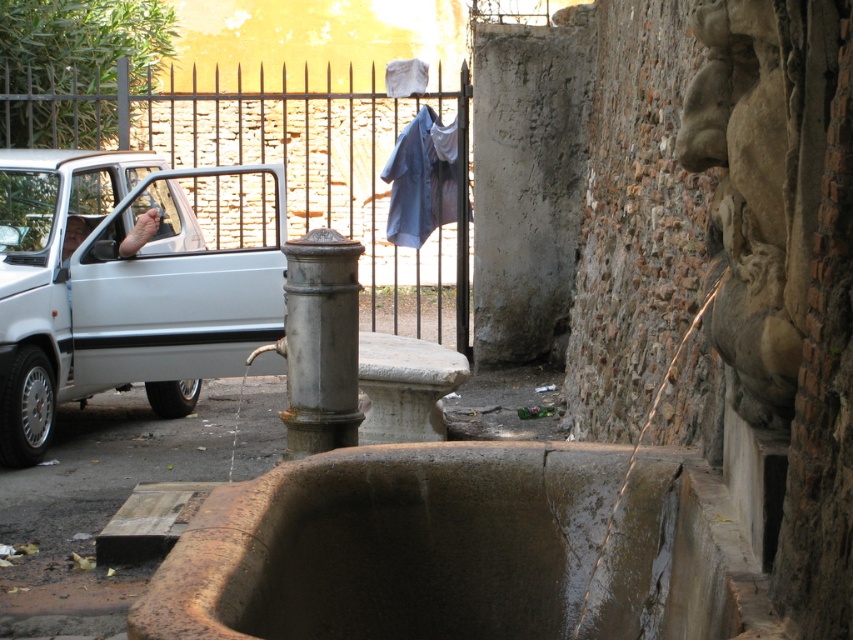
Question: Estimate the real-world distances between objects in this image. Which object is closer to the silver metallic pillar at center?

Choices:
 (A) blue fabric at center
 (B) metallic iron gate at upper center
 (C) white matte car at left

Answer: (A)

Question: In this image, where is white matte car at left located relative to metallic iron gate at upper center?

Choices:
 (A) right
 (B) left

Answer: (B)

Question: Which of these objects is positioned closest to the blue fabric at center?

Choices:
 (A) metallic iron gate at upper center
 (B) silver metallic pillar at center

Answer: (A)

Question: Observing the image, what is the correct spatial positioning of silver metallic pillar at center in reference to blue fabric at center?

Choices:
 (A) below
 (B) above

Answer: (A)

Question: Can you confirm if white matte car at left is wider than silver metallic pillar at center?

Choices:
 (A) yes
 (B) no

Answer: (B)

Question: Among these points, which one is nearest to the camera?

Choices:
 (A) (412, 124)
 (B) (91, 196)

Answer: (B)